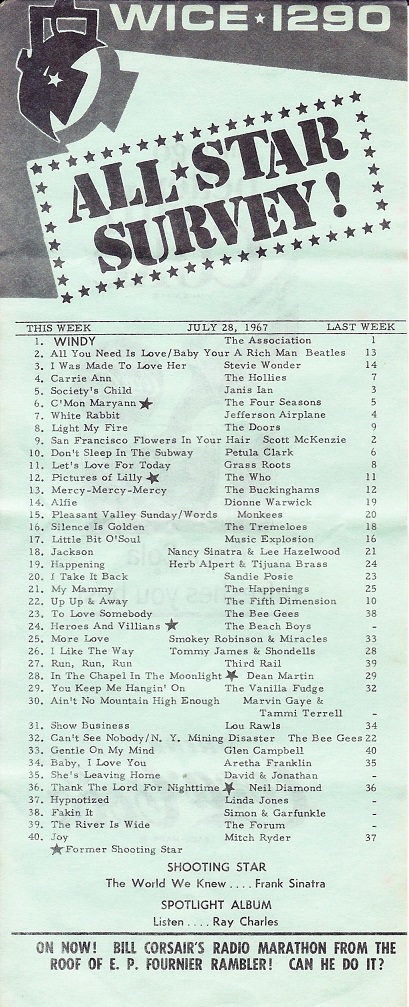
Locate an element on the screen. The image size is (409, 1007). stage light is located at coordinates (69, 49).